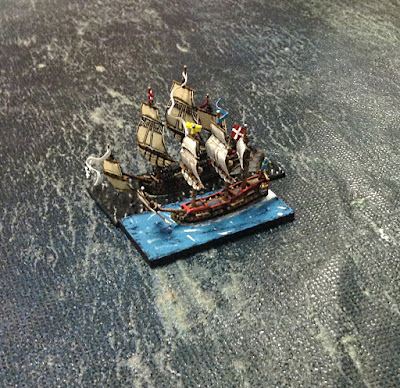
Where is `toy`? toy is located at coordinates (x=202, y=216), (x=110, y=189).